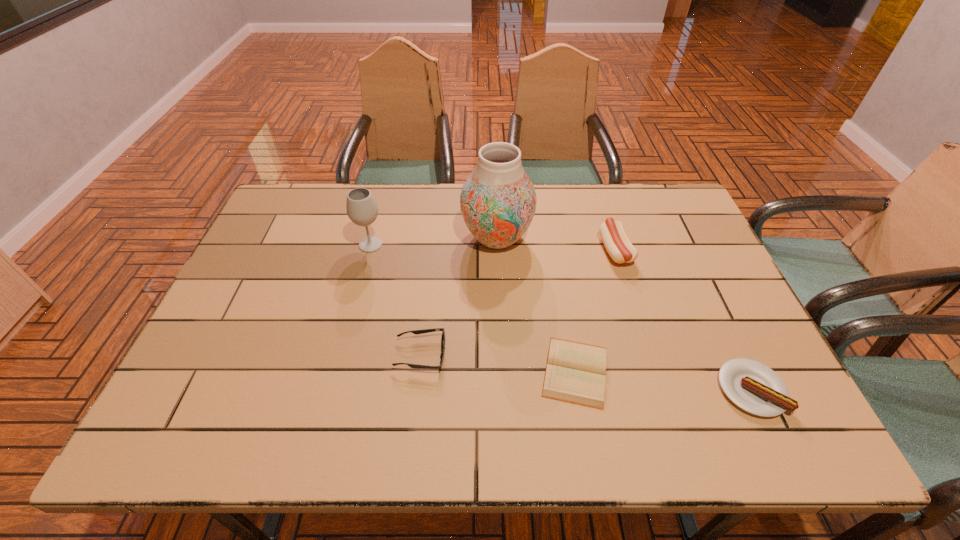
Locate an element on the screen. The height and width of the screenshot is (540, 960). free spot located on the right of the fifth shortest object is located at coordinates (474, 245).

Find the location of a particular element. The width and height of the screenshot is (960, 540). vacant space located 0.140m on the left of the farther sausage is located at coordinates (554, 250).

This screenshot has height=540, width=960. I want to click on vacant space situated 0.140m on the back of the nearer sausage, so click(716, 316).

I want to click on vacant area situated 0.100m on the front-facing side of the sunglasses, so click(488, 355).

What are the coordinates of `free space located 0.130m on the back of the shortest object` in the screenshot? It's located at (563, 298).

This screenshot has width=960, height=540. What are the coordinates of `object present at the far edge` in the screenshot? It's located at (498, 201).

The height and width of the screenshot is (540, 960). Find the location of `sausage that is at the near edge`. sausage that is at the near edge is located at coordinates (754, 387).

This screenshot has width=960, height=540. I want to click on diary located in the near edge section of the desktop, so click(x=575, y=372).

Identify the location of object that is at the right edge. Image resolution: width=960 pixels, height=540 pixels. (754, 387).

The width and height of the screenshot is (960, 540). I want to click on object present at the near right corner, so 754,387.